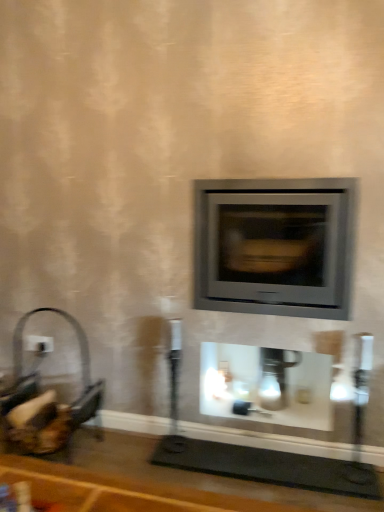
What do you see at coordinates (39, 343) in the screenshot?
I see `white plastic electric outlet at left` at bounding box center [39, 343].

This screenshot has width=384, height=512. What do you see at coordinates (275, 246) in the screenshot?
I see `matte gray wood burning stove at center` at bounding box center [275, 246].

Image resolution: width=384 pixels, height=512 pixels. What are the coordinates of `white glossy fireplace at center` in the screenshot? It's located at (266, 385).

Between white glossy fireplace at center and matte gray wood burning stove at center, which one has more height?

With more height is matte gray wood burning stove at center.

Which of these two, white glossy fireplace at center or matte gray wood burning stove at center, is wider?

Wider between the two is white glossy fireplace at center.

Considering the sizes of objects white glossy fireplace at center and matte gray wood burning stove at center in the image provided, who is smaller, white glossy fireplace at center or matte gray wood burning stove at center?

white glossy fireplace at center.

Could you tell me if matte gray wood burning stove at center is turned towards white glossy fireplace at center?

No, matte gray wood burning stove at center is not turned towards white glossy fireplace at center.

From a real-world perspective, which is physically above, matte gray wood burning stove at center or white glossy fireplace at center?

matte gray wood burning stove at center, from a real-world perspective.

Does point (340, 262) come closer to viewer compared to point (242, 380)?

Yes, it is in front of point (242, 380).

Which object is positioned more to the left, matte gray wood burning stove at center or white glossy fireplace at center?

matte gray wood burning stove at center is more to the left.

From a real-world perspective, is matte gray wood burning stove at center over white plastic electric outlet at left?

Yes, from a real-world perspective, matte gray wood burning stove at center is over white plastic electric outlet at left

Does matte gray wood burning stove at center have a greater width compared to white plastic electric outlet at left?

Yes.

At what (x,y) coordinates should I click in order to perform the action: click on electric outlet behind the matte gray wood burning stove at center. Please return your answer as a coordinate pair (x, y). The height and width of the screenshot is (512, 384). Looking at the image, I should click on (39, 343).

Which is behind, matte gray wood burning stove at center or white plastic electric outlet at left?

Positioned behind is white plastic electric outlet at left.

Is white glossy fireplace at center to the left of white plastic electric outlet at left from the viewer's perspective?

No, white glossy fireplace at center is not to the left of white plastic electric outlet at left.

Considering their positions, is white glossy fireplace at center located in front of or behind white plastic electric outlet at left?

white glossy fireplace at center is positioned closer to the viewer than white plastic electric outlet at left.

Is white plastic electric outlet at left completely or partially inside white glossy fireplace at center?

No.

Which of these two, white plastic electric outlet at left or matte gray wood burning stove at center, stands taller?

With more height is matte gray wood burning stove at center.

Considering the relative sizes of white plastic electric outlet at left and matte gray wood burning stove at center in the image provided, is white plastic electric outlet at left smaller than matte gray wood burning stove at center?

Correct, white plastic electric outlet at left occupies less space than matte gray wood burning stove at center.

From a real-world perspective, is white plastic electric outlet at left located beneath matte gray wood burning stove at center?

Yes, from a real-world perspective, white plastic electric outlet at left is below matte gray wood burning stove at center.

Considering the positions of objects white plastic electric outlet at left and matte gray wood burning stove at center in the image provided, who is more to the left, white plastic electric outlet at left or matte gray wood burning stove at center?

white plastic electric outlet at left.

From a real-world perspective, which is physically above, white plastic electric outlet at left or white glossy fireplace at center?

white plastic electric outlet at left is physically above.

Considering the positions of objects white plastic electric outlet at left and white glossy fireplace at center in the image provided, who is more to the left, white plastic electric outlet at left or white glossy fireplace at center?

Positioned to the left is white plastic electric outlet at left.

Based on the photo, can we say white plastic electric outlet at left lies outside white glossy fireplace at center?

Indeed, white plastic electric outlet at left is completely outside white glossy fireplace at center.

Where is `fireplace located below the white plastic electric outlet at left (from the image's perspective)`? The width and height of the screenshot is (384, 512). fireplace located below the white plastic electric outlet at left (from the image's perspective) is located at coordinates (266, 385).

At what (x,y) coordinates should I click in order to perform the action: click on wood burning stove in front of the white glossy fireplace at center. Please return your answer as a coordinate pair (x, y). Looking at the image, I should click on pos(275,246).

This screenshot has height=512, width=384. In order to click on fireplace located on the right of matte gray wood burning stove at center in this screenshot , I will do `click(266, 385)`.

Which object lies further to the anchor point white plastic electric outlet at left, white glossy fireplace at center or matte gray wood burning stove at center?

Among the two, matte gray wood burning stove at center is located further to white plastic electric outlet at left.

Based on their spatial positions, is matte gray wood burning stove at center or white plastic electric outlet at left closer to white glossy fireplace at center?

matte gray wood burning stove at center is positioned closer to the anchor white glossy fireplace at center.

From the picture: Looking at the image, which one is located closer to white glossy fireplace at center, white plastic electric outlet at left or matte gray wood burning stove at center?

Among the two, matte gray wood burning stove at center is located nearer to white glossy fireplace at center.

Estimate the real-world distances between objects in this image. Which object is further from white plastic electric outlet at left, matte gray wood burning stove at center or white glossy fireplace at center?

matte gray wood burning stove at center lies further to white plastic electric outlet at left than the other object.

Based on their spatial positions, is white plastic electric outlet at left or white glossy fireplace at center further from matte gray wood burning stove at center?

white plastic electric outlet at left is further to matte gray wood burning stove at center.

When comparing their distances from matte gray wood burning stove at center, does white glossy fireplace at center or white plastic electric outlet at left seem further?

Among the two, white plastic electric outlet at left is located further to matte gray wood burning stove at center.

At what (x,y) coordinates should I click in order to perform the action: click on wood burning stove located between white plastic electric outlet at left and white glossy fireplace at center in the left-right direction. Please return your answer as a coordinate pair (x, y). Image resolution: width=384 pixels, height=512 pixels. Looking at the image, I should click on tap(275, 246).